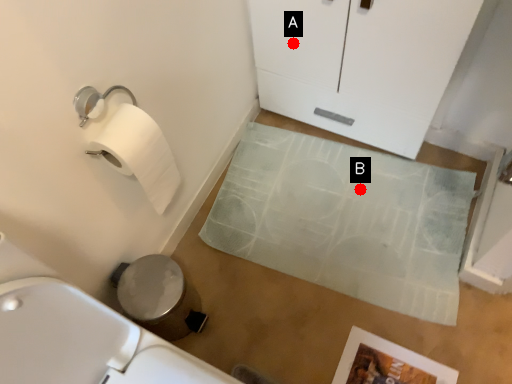
Question: Two points are circled on the image, labeled by A and B beside each circle. Which point is further to the camera?

Choices:
 (A) A is further
 (B) B is further

Answer: (B)